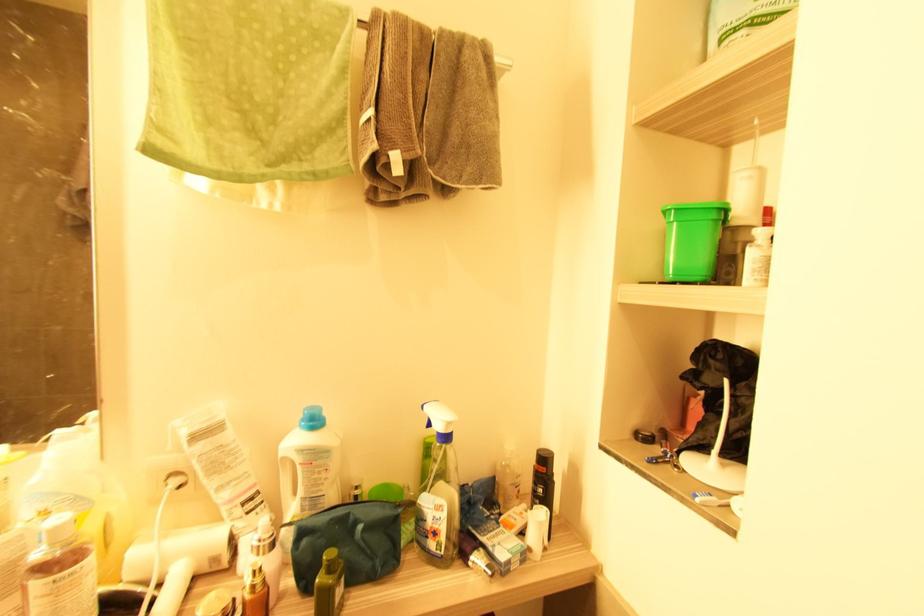
Find where to lift the green plastic bucket. Please return your answer as a coordinate pair (x, y).

(691, 238)